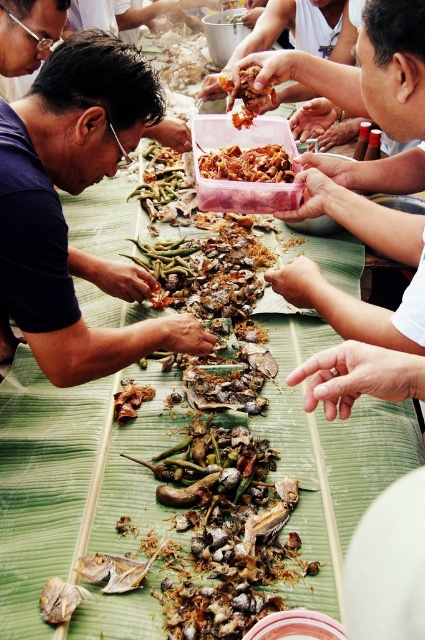
Is dark blue shirt at left further to camera compared to shiny brown meat at center?

No.

Based on the photo, who is more forward, (90, 330) or (203, 193)?

Positioned in front is point (90, 330).

Identify the location of dark blue shirt at left. The image size is (425, 640). (74, 195).

Can you confirm if shiny brown meat at center is shorter than spicy brown meat at center?

Incorrect, shiny brown meat at center's height does not fall short of spicy brown meat at center's.

Describe the element at coordinates (246, 179) in the screenshot. I see `shiny brown meat at center` at that location.

Which is behind, point (266, 145) or point (246, 93)?

The point (266, 145) is more distant.

Where is `shiny brown meat at center`? The width and height of the screenshot is (425, 640). shiny brown meat at center is located at coordinates [246, 179].

Does point (99, 333) lie behind point (263, 96)?

That is False.

Where is `dark blue shirt at left`? dark blue shirt at left is located at coordinates (74, 195).

The height and width of the screenshot is (640, 425). I want to click on dark blue shirt at left, so click(74, 195).